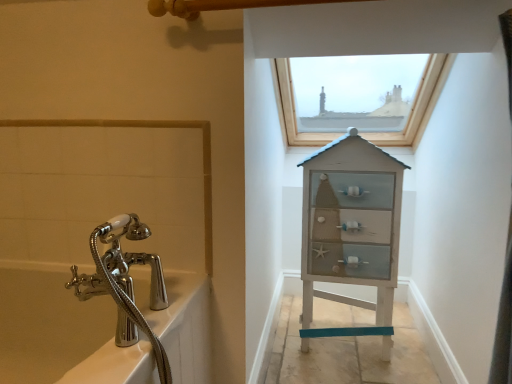
What is the approximate width of wooden frame window at upper center?

wooden frame window at upper center is 75.01 centimeters wide.

Locate an element on the screen. polished chrome bath at left is located at coordinates (61, 332).

Would you say white wood cabinet at center is a long distance from wooden frame window at upper center?

Actually, white wood cabinet at center and wooden frame window at upper center are a little close together.

Locate an element on the screen. window behind the white wood cabinet at center is located at coordinates (359, 96).

Is the depth of white wood cabinet at center less than that of wooden frame window at upper center?

Yes, it is.

Is point (364, 251) farther from viewer compared to point (302, 145)?

No.

How different are the orientations of polished chrome bath at left and wooden frame window at upper center in degrees?

0.884 degrees separate the facing orientations of polished chrome bath at left and wooden frame window at upper center.

Which object is positioned more to the left, polished chrome bath at left or wooden frame window at upper center?

polished chrome bath at left.

Locate an element on the screen. Image resolution: width=512 pixels, height=384 pixels. bath that appears in front of the wooden frame window at upper center is located at coordinates (61, 332).

Which is behind, point (192, 362) or point (305, 66)?

The point (305, 66) is farther.

Is white wood cabinet at center situated inside polished chrome bath at left or outside?

white wood cabinet at center is not inside polished chrome bath at left, it's outside.

From a real-world perspective, is white wood cabinet at center physically located above or below polished chrome bath at left?

white wood cabinet at center is situated higher than polished chrome bath at left in the real world.

Which is in front, white wood cabinet at center or polished chrome bath at left?

polished chrome bath at left is more forward.

From the image's perspective, which object appears higher, polished chrome bath at left or white wood cabinet at center?

From the image's view, white wood cabinet at center is above.

Based on the photo, which is more to the right, polished chrome bath at left or white wood cabinet at center?

From the viewer's perspective, white wood cabinet at center appears more on the right side.

Is polished chrome bath at left touching white wood cabinet at center?

polished chrome bath at left is not next to white wood cabinet at center, and they're not touching.

You are a GUI agent. You are given a task and a screenshot of the screen. Output one action in this format:
    pyautogui.click(x=<x>, y=<y>)
    Task: Click on the medicine cabinet above the polished chrome bath at left (from a real-world perspective)
    Image resolution: width=512 pixels, height=384 pixels.
    Given the screenshot: What is the action you would take?
    pyautogui.click(x=351, y=230)

Can you tell me how much wooden frame window at upper center and white wood cabinet at center differ in facing direction?

The angle between the facing direction of wooden frame window at upper center and the facing direction of white wood cabinet at center is 3.58 degrees.

In terms of height, does wooden frame window at upper center look taller or shorter compared to white wood cabinet at center?

Clearly, wooden frame window at upper center is shorter compared to white wood cabinet at center.

Would you say wooden frame window at upper center is a long distance from white wood cabinet at center?

They are positioned close to each other.

At what (x,y) coordinates should I click in order to perform the action: click on medicine cabinet directly beneath the wooden frame window at upper center (from a real-world perspective). Please return your answer as a coordinate pair (x, y). This screenshot has width=512, height=384. Looking at the image, I should click on click(x=351, y=230).

Consider the image. Can you confirm if wooden frame window at upper center is shorter than polished chrome bath at left?

Yes, wooden frame window at upper center is shorter than polished chrome bath at left.

Which is in front, wooden frame window at upper center or polished chrome bath at left?

polished chrome bath at left is closer to the camera.

From the image's perspective, does wooden frame window at upper center appear higher than polished chrome bath at left?

Yes.

Would you say wooden frame window at upper center contains polished chrome bath at left?

No, polished chrome bath at left is not inside wooden frame window at upper center.

What are the coordinates of `window behind the white wood cabinet at center` in the screenshot? It's located at (359, 96).

This screenshot has height=384, width=512. I want to click on bath in front of the wooden frame window at upper center, so click(x=61, y=332).

Estimate the real-world distances between objects in this image. Which object is further from white wood cabinet at center, wooden frame window at upper center or polished chrome bath at left?

The object further to white wood cabinet at center is polished chrome bath at left.

From the image, which object appears to be farther from wooden frame window at upper center, white wood cabinet at center or polished chrome bath at left?

Among the two, polished chrome bath at left is located further to wooden frame window at upper center.

When comparing their distances from wooden frame window at upper center, does polished chrome bath at left or white wood cabinet at center seem closer?

The object closer to wooden frame window at upper center is white wood cabinet at center.

Based on their spatial positions, is white wood cabinet at center or wooden frame window at upper center further from polished chrome bath at left?

Among the two, wooden frame window at upper center is located further to polished chrome bath at left.

Looking at the image, which one is located further to polished chrome bath at left, wooden frame window at upper center or white wood cabinet at center?

wooden frame window at upper center is further to polished chrome bath at left.

Considering their positions, is polished chrome bath at left positioned further to white wood cabinet at center than wooden frame window at upper center?

Based on the image, polished chrome bath at left appears to be further to white wood cabinet at center.

The height and width of the screenshot is (384, 512). What are the coordinates of `medicine cabinet between polished chrome bath at left and wooden frame window at upper center` in the screenshot? It's located at (351, 230).